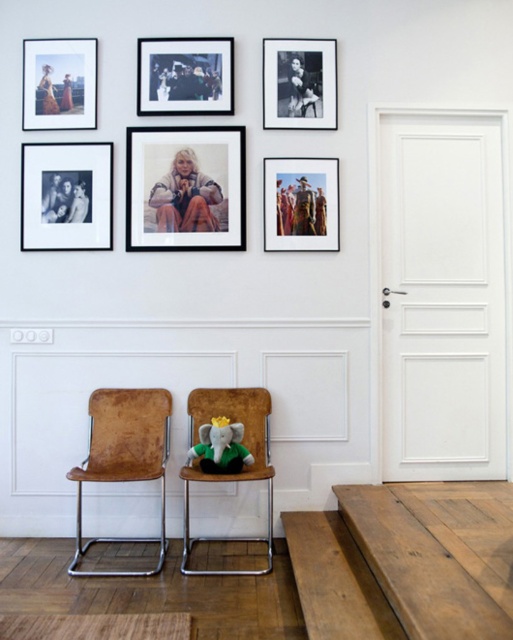
You are standing in the room and want to move closer to the brown leather chair at center. If you walk forward 2 meters, will you reach the chair?

The distance between you and the brown leather chair at center is 3.13 meters. After walking 2 meters, you will still be 1.13 meters away from the chair, so you have not reached it yet.

You are standing in the room facing the gallery wall. There are two points marked on the wall in front of you. The first point is at coordinates point [261,424] and the second point is at point [50,125]. Which point is closer to your current position?

Point [261,424] is closer to the camera than point [50,125], so the first point is closer to your current position.

You are an interior designer planning to replace the black matte picture frame at upper center and the brown leather chair at center with new items. If you want to maintain the current spatial balance between them, which item should be made larger?

The black matte picture frame at upper center is smaller than the brown leather chair at center. To maintain spatial balance, the item that is currently smaller, the black matte picture frame at upper center, should be made larger to match the size of the brown leather chair at center.